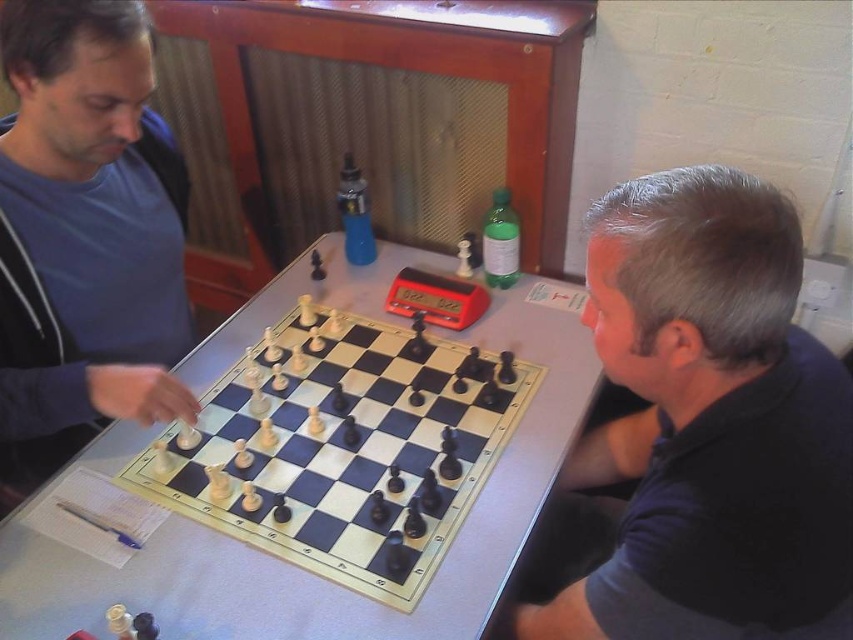
You are a chess player sitting at the chessboard. You need to move a piece from point A to point B. The coordinates for point A are point (767, 225) and point B are point (42, 115). Considering the chessboard layout, will moving from point A to point B require passing over any other pieces?

Based on the coordinates provided, point (767, 225) is in front of point (42, 115). Since the chessboard is set up with pieces in their starting positions, moving from point A to point B would require moving forward towards the opponent. However, in the starting position, there are no pieces between these two points. Therefore, the move can be made without passing over any other pieces.

You are a photographer trying to capture a closeup of the chessboard while ensuring both players are visible. Given that the dark blue shirt at right and the white plastic chessboard at center are in the frame, which object should you focus on to ensure the narrower subject is properly framed?

The dark blue shirt at right has a lesser width compared to the white plastic chessboard at center, so you should focus on the dark blue shirt at right to ensure the narrower subject is properly framed.